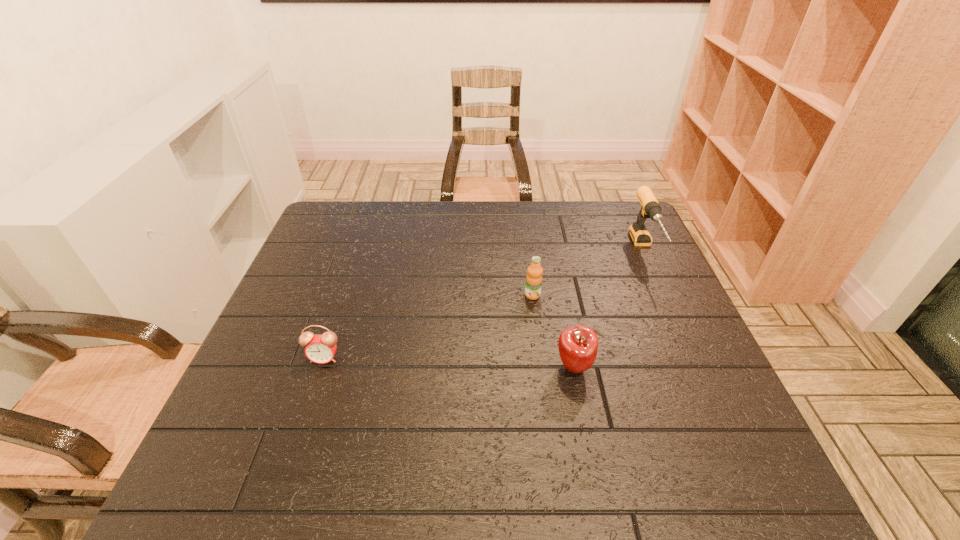
In order to click on the tallest object in this screenshot , I will do `click(650, 208)`.

The image size is (960, 540). In order to click on the rightmost object in this screenshot , I will do `click(650, 208)`.

Locate an element on the screen. the second farthest object is located at coordinates (533, 286).

The image size is (960, 540). In order to click on orange juice in this screenshot , I will do `click(533, 286)`.

Image resolution: width=960 pixels, height=540 pixels. I want to click on the second object from right to left, so click(578, 345).

Find the location of a particular element. The height and width of the screenshot is (540, 960). alarm clock is located at coordinates (320, 349).

What are the coordinates of `blank space located 0.310m on the handle side of the tallest object` in the screenshot? It's located at (700, 370).

Where is `vacant space located 0.140m on the label of the orange juice`? Image resolution: width=960 pixels, height=540 pixels. vacant space located 0.140m on the label of the orange juice is located at coordinates (539, 342).

Identify the location of free space located 0.310m on the back of the second object from right to left. (554, 266).

Identify the location of vacant point located on the clock face of the alarm clock. This screenshot has height=540, width=960. (289, 464).